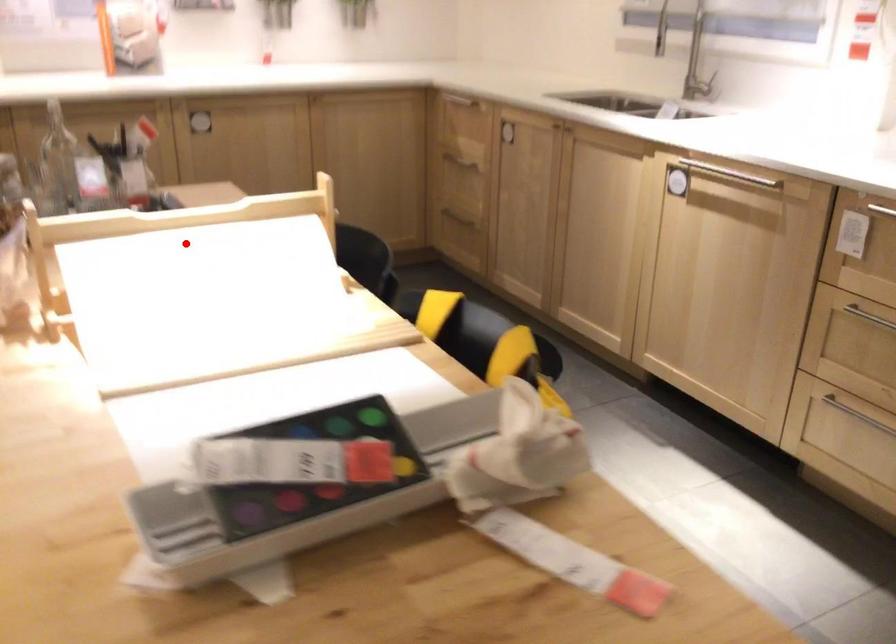
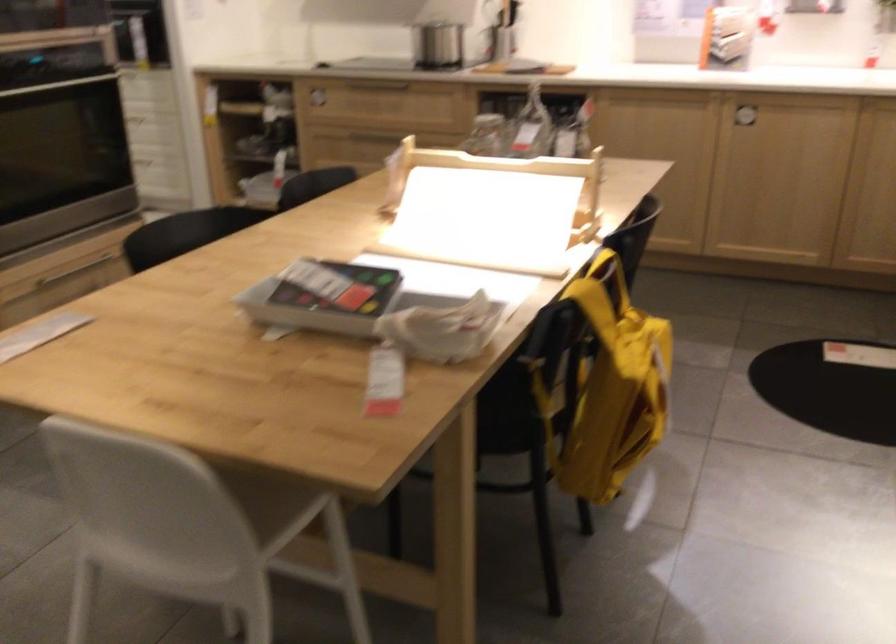
Question: I am providing you with two images of the same scene from different viewpoints. Image1 has a red point marked. In image2, the corresponding 3D location appears at what relative position? Reply with the corresponding letter.

Choices:
 (A) Closer
 (B) Farther

Answer: (B)